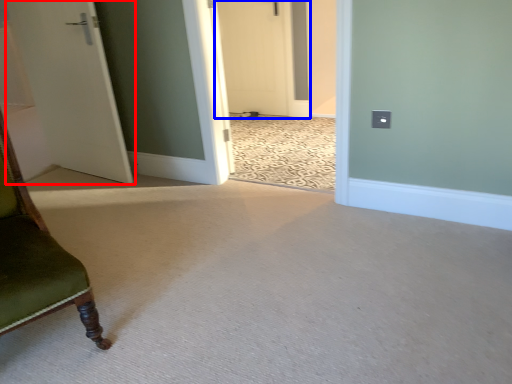
Question: Which point is further to the camera, door (highlighted by a red box) or door (highlighted by a blue box)?

Choices:
 (A) door
 (B) door

Answer: (B)